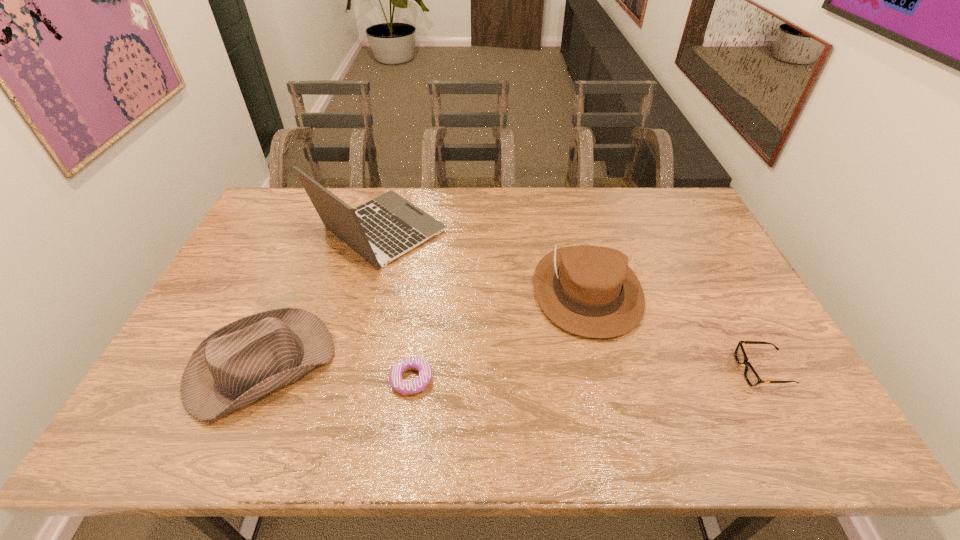
This screenshot has width=960, height=540. What are the coordinates of `vacant space at the near edge of the desktop` in the screenshot? It's located at (671, 424).

In the image, there is a desktop. At what (x,y) coordinates should I click in order to perform the action: click on vacant space at the left edge. Please return your answer as a coordinate pair (x, y). Looking at the image, I should click on (260, 236).

What are the coordinates of `vacant area at the right edge` in the screenshot? It's located at (708, 323).

Image resolution: width=960 pixels, height=540 pixels. In order to click on vacant position at the far left corner of the desktop in this screenshot , I will do `click(257, 224)`.

The width and height of the screenshot is (960, 540). Identify the location of vacant space at the far right corner of the desktop. (664, 222).

Find the location of a particular element. This screenshot has height=540, width=960. vacant space that is in between the sunglasses and the taller fedora is located at coordinates (675, 330).

This screenshot has height=540, width=960. I want to click on free space that is in between the left fedora and the rightmost object, so click(x=512, y=368).

At what (x,y) coordinates should I click in order to perform the action: click on free space between the doughnut and the laptop_computer. Please return your answer as a coordinate pair (x, y). Image resolution: width=960 pixels, height=540 pixels. Looking at the image, I should click on (396, 306).

The image size is (960, 540). In order to click on free space between the laptop_computer and the doughnut in this screenshot , I will do `click(396, 306)`.

This screenshot has height=540, width=960. In order to click on vacant point located between the doughnut and the sunglasses in this screenshot , I will do `click(587, 375)`.